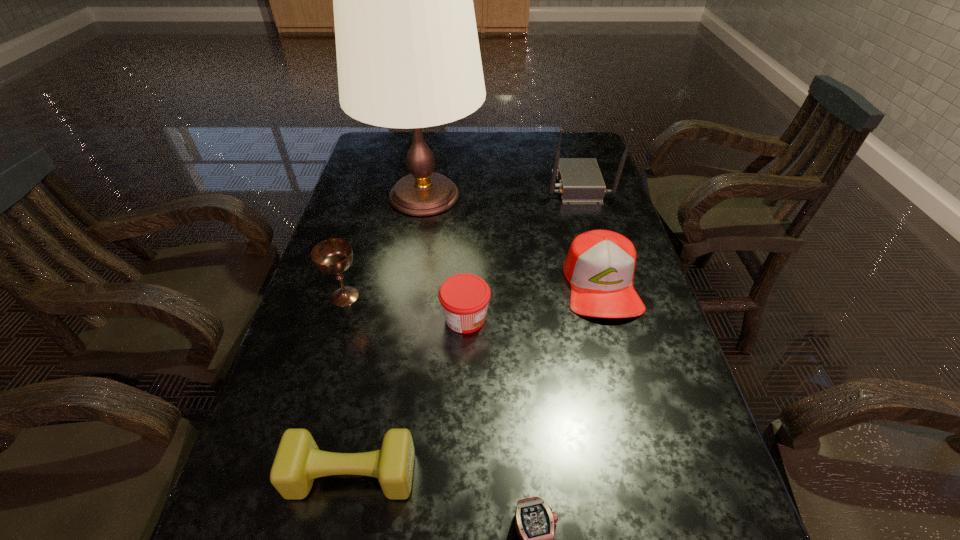
What are the coordinates of `free space between the fourth tallest object and the tallest object` in the screenshot? It's located at (513, 240).

The width and height of the screenshot is (960, 540). What are the coordinates of `vacant area between the dumbbell and the fourth shortest object` in the screenshot? It's located at (477, 379).

Find the location of a particular element. This screenshot has width=960, height=540. vacant area that lies between the dumbbell and the jam is located at coordinates (409, 396).

The image size is (960, 540). I want to click on object that is the third nearest to the chalice, so click(x=298, y=461).

At what (x,y) coordinates should I click in order to perform the action: click on object that stands as the sixth closest to the watch. Please return your answer as a coordinate pair (x, y). Looking at the image, I should click on (580, 181).

Locate an element on the screen. This screenshot has height=540, width=960. vacant point that satisfies the following two spatial constraints: 1. on the back of the router to connect cables; 2. on the front-facing side of the baseball cap is located at coordinates (606, 284).